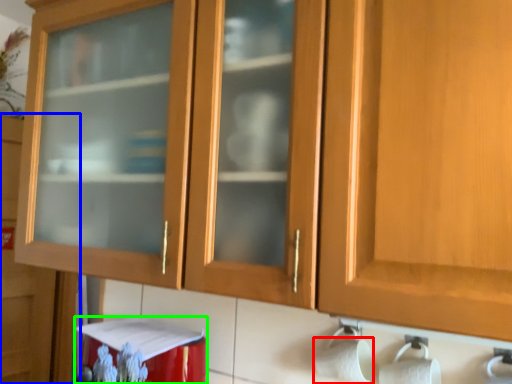
Question: Estimate the real-world distances between objects in this image. Which object is farther from toilet paper (highlighted by a red box), cupboard (highlighted by a blue box) or appliance (highlighted by a green box)?

Choices:
 (A) cupboard
 (B) appliance

Answer: (A)